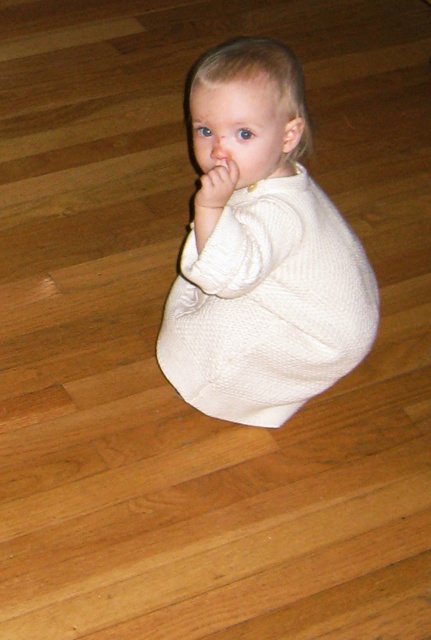
You are a photographer setting up for a closeup shot of the child in the image. You need to focus on the white matte hand at center and the smooth cream skin at center. Which object should you focus on first to ensure proper depth of field?

You should focus on the white matte hand at center first because it is closer to the viewer than the smooth cream skin at center, ensuring the depth of field captures both objects properly.

The scene shows a child sitting on a wooden floor wearing a light colored garment. There is a point marked at coordinates (262, 253). What object is located at this point?

The point at coordinates (262, 253) marks the white knitted sweater at center.